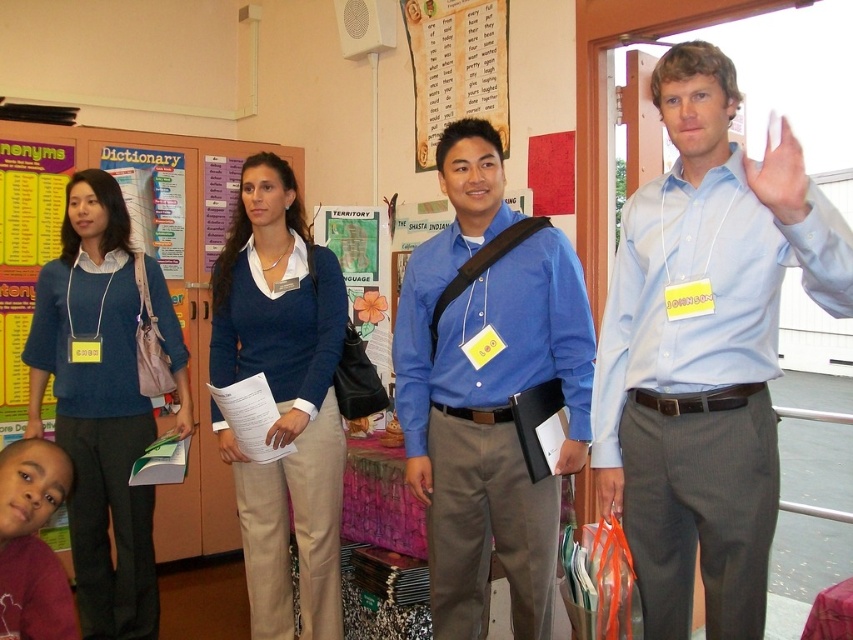
You are a photographer standing at the back of the classroom. You want to take a photo of the light blue shirt at center and the white paper at center. If your camera has a minimum focus distance of 1 meter, will you be able to capture both subjects clearly in the same frame?

The light blue shirt at center is 1.28 meters from the white paper at center. Since the distance between them is greater than the camera minimum focus distance of 1 meter, the photographer can capture both subjects clearly in the same frame.

You are organizing a photo shoot and need to arrange two shirts for a display. The blue smooth shirt at center and the matte blue shirt at center must be placed side by side. Which shirt should be placed on the left to ensure the larger one is on the right?

The blue smooth shirt at center should be placed on the right side since it is larger than the matte blue shirt at center, ensuring the larger one is positioned on the right.

You are organizing a photo shoot and need to ensure that all participants are visible in the frame. Given that the blue sweater at left and the matte blue shirt at center are two focal points, which one might require more space in the composition to maintain clarity?

The blue sweater at left is larger in size than the matte blue shirt at center, so it would require more space in the composition to maintain clarity.